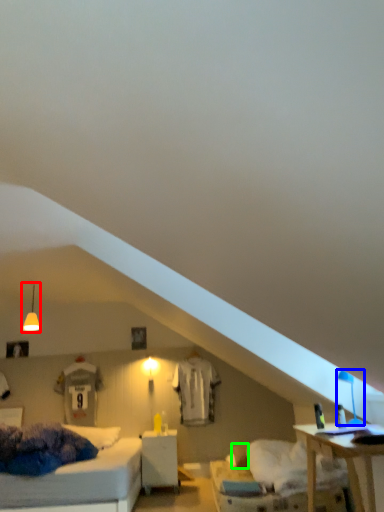
Question: Considering the real-world distances, which object is farthest from fixture (highlighted by a red box)? table lamp (highlighted by a blue box) or pillow (highlighted by a green box)?

Choices:
 (A) table lamp
 (B) pillow

Answer: (A)